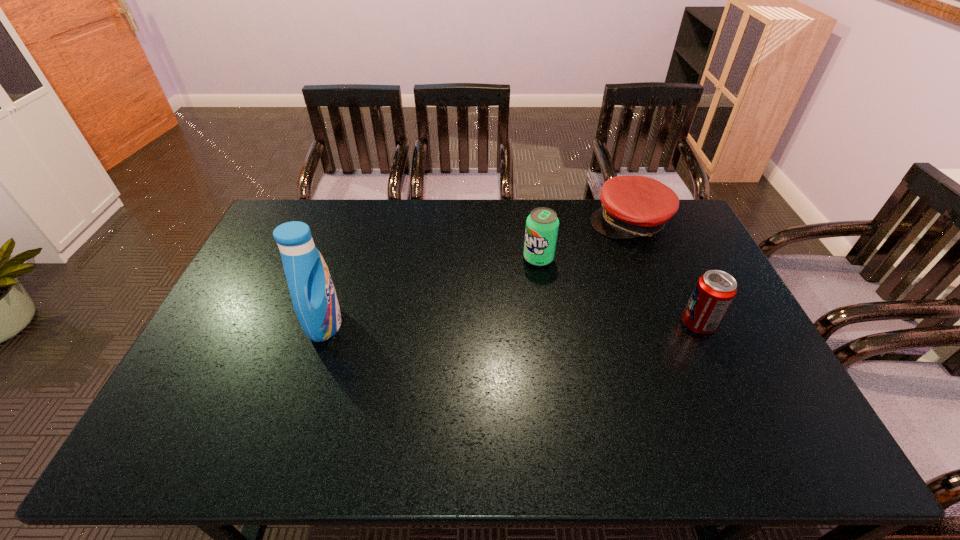
This screenshot has height=540, width=960. I want to click on the tallest object, so click(315, 302).

At what (x,y) coordinates should I click in order to perform the action: click on detergent. Please return your answer as a coordinate pair (x, y). The image size is (960, 540). Looking at the image, I should click on (315, 302).

Locate an element on the screen. The image size is (960, 540). the nearer pop soda is located at coordinates (715, 290).

You are a GUI agent. You are given a task and a screenshot of the screen. Output one action in this format:
    pyautogui.click(x=<x>, y=<y>)
    Task: Click on the farther pop soda
    The width and height of the screenshot is (960, 540).
    Given the screenshot: What is the action you would take?
    pyautogui.click(x=542, y=224)

Where is `the second farthest object`? The width and height of the screenshot is (960, 540). the second farthest object is located at coordinates (542, 224).

Where is `the shortest object`? the shortest object is located at coordinates (633, 206).

Find the location of `cap`. cap is located at coordinates (633, 206).

The width and height of the screenshot is (960, 540). What are the coordinates of `free point located on the front-facing side of the detergent` in the screenshot? It's located at (403, 324).

Identify the location of blank space located 0.210m on the front of the right pop soda. Image resolution: width=960 pixels, height=540 pixels. (734, 404).

Locate an element on the screen. The height and width of the screenshot is (540, 960). free point located 0.180m on the front-facing side of the second farthest object is located at coordinates (503, 300).